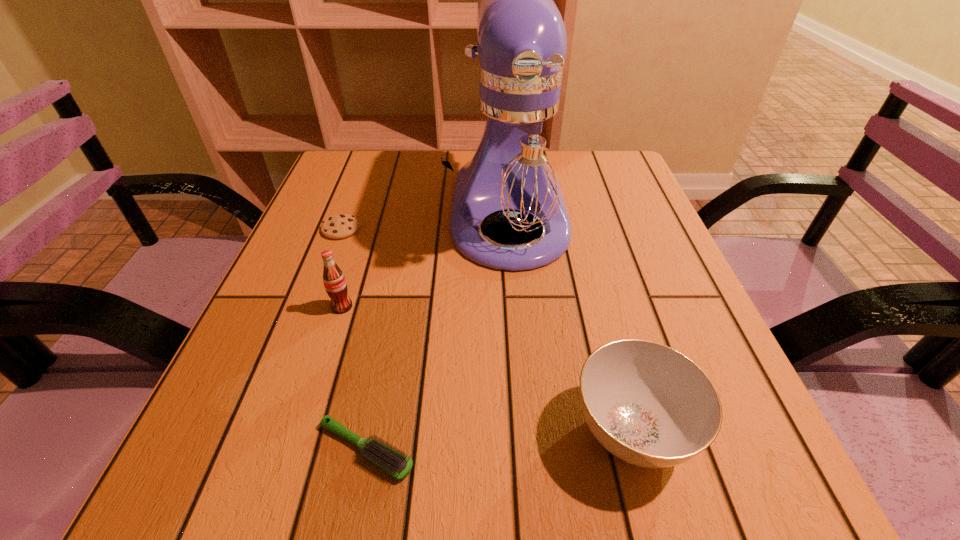
At what (x,y) coordinates should I click in order to perform the action: click on mixer. Please return your answer as a coordinate pair (x, y). Looking at the image, I should click on (515, 162).

You are a GUI agent. You are given a task and a screenshot of the screen. Output one action in this format:
    pyautogui.click(x=<x>, y=<y>)
    Task: Click on the third nearest object
    Image resolution: width=960 pixels, height=540 pixels.
    Given the screenshot: What is the action you would take?
    pyautogui.click(x=335, y=284)

Where is `the fourth shortest object`? This screenshot has height=540, width=960. the fourth shortest object is located at coordinates (335, 284).

You are a GUI agent. You are given a task and a screenshot of the screen. Output one action in this format:
    pyautogui.click(x=<x>, y=<y>)
    Task: Click on the chinaware
    The image size is (960, 540).
    Given the screenshot: What is the action you would take?
    pyautogui.click(x=649, y=405)

Identify the location of cookie. (339, 226).

Image resolution: width=960 pixels, height=540 pixels. Identify the location of the third object from left to right. (393, 462).

Image resolution: width=960 pixels, height=540 pixels. What are the coordinates of `free region located at the mixing area of the mixer` in the screenshot? It's located at (519, 334).

Find the location of `vacant point located 0.210m on the right of the fourth shortest object`. vacant point located 0.210m on the right of the fourth shortest object is located at coordinates (468, 307).

You are a GUI agent. You are given a task and a screenshot of the screen. Output one action in this format:
    pyautogui.click(x=<x>, y=<y>)
    Task: Click on the blank space located on the left of the third shortest object
    This screenshot has height=540, width=960.
    Given the screenshot: What is the action you would take?
    pyautogui.click(x=478, y=430)

Where is `vacant space located on the front of the cookie`? This screenshot has width=960, height=540. vacant space located on the front of the cookie is located at coordinates (307, 318).